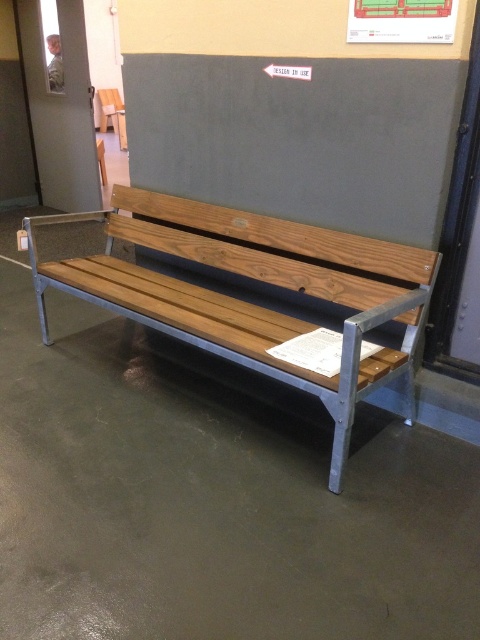
You are an interior designer arranging furniture in a room. You have a wooden bench at center and a matte white paper at upper center. According to the scene, which object is positioned to the left of the other?

The wooden bench at center is to the left of matte white paper at upper center.

You are an interior designer planning to place a new decorative item on the matte white paper at upper center. Considering the wooden bench at center is currently blocking the view of the paper, how can you adjust the bench to make the paper more visible?

The wooden bench at center is in front of matte white paper at upper center, so moving the bench away from the wall would allow the matte white paper at upper center to become more visible.